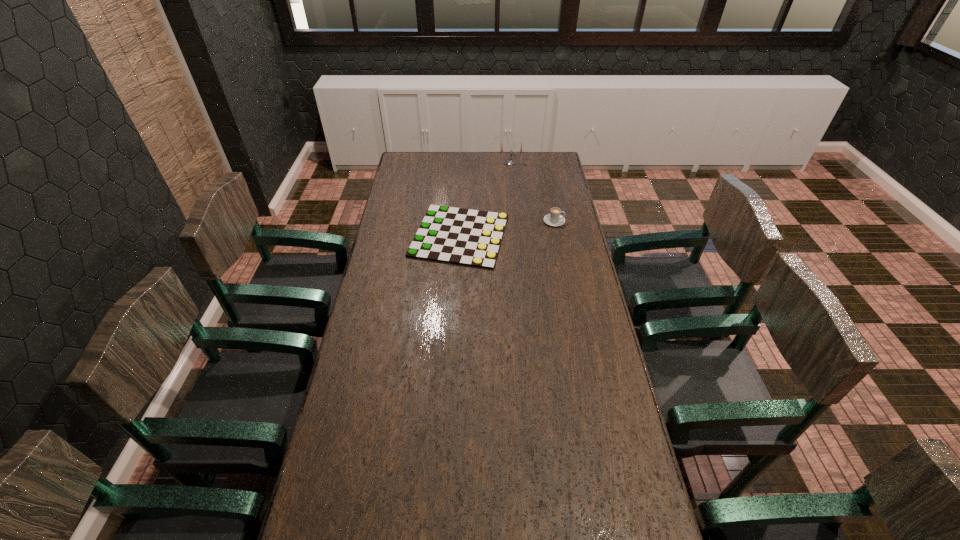
In order to click on free space at the far edge of the desktop in this screenshot , I will do `click(514, 173)`.

Locate an element on the screen. The image size is (960, 540). vacant area at the left edge of the desktop is located at coordinates (320, 465).

The image size is (960, 540). In the image, there is a desktop. Identify the location of free space at the right edge. (581, 264).

Locate an element on the screen. vacant space at the far left corner of the desktop is located at coordinates 402,157.

Identify the location of vacant area that lies between the cappuccino and the checkerboard. Image resolution: width=960 pixels, height=540 pixels. (507, 228).

At what (x,y) coordinates should I click in order to perform the action: click on free area in between the shortest object and the cappuccino. Please return your answer as a coordinate pair (x, y). This screenshot has width=960, height=540. Looking at the image, I should click on (507, 228).

Image resolution: width=960 pixels, height=540 pixels. What are the coordinates of `vacant area between the shortest object and the tallest object` in the screenshot? It's located at (485, 199).

Where is `vacant area that lies between the cappuccino and the checkerboard`? The image size is (960, 540). vacant area that lies between the cappuccino and the checkerboard is located at coordinates (507, 228).

Locate an element on the screen. This screenshot has height=540, width=960. vacant area that lies between the checkerboard and the candle is located at coordinates (485, 199).

Image resolution: width=960 pixels, height=540 pixels. In order to click on free area in between the checkerboard and the farthest object in this screenshot , I will do `click(485, 199)`.